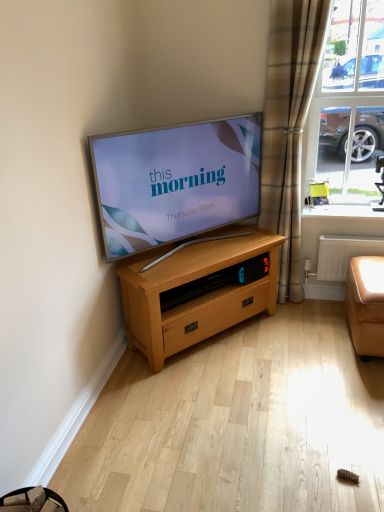
Where is `vacant space positioned to the left of leather-like orange couch at lower right`? The image size is (384, 512). vacant space positioned to the left of leather-like orange couch at lower right is located at coordinates (306, 337).